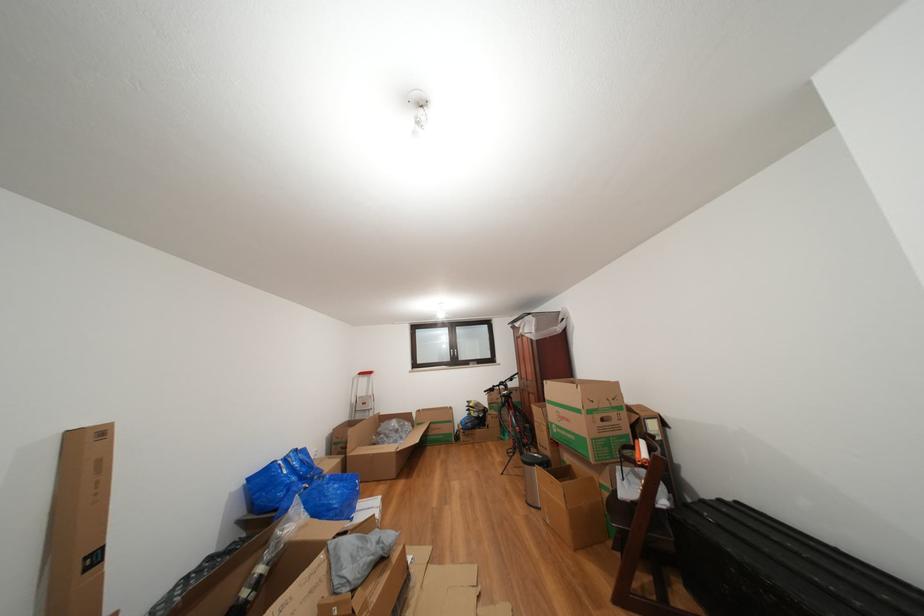
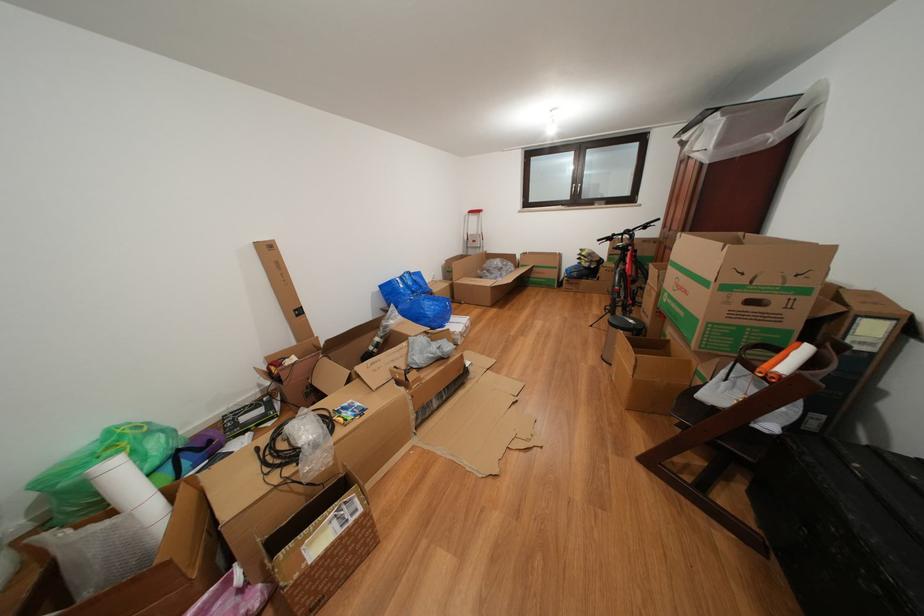
In the second image, find the point that corresponds to [576,426] in the first image.

(694, 297)